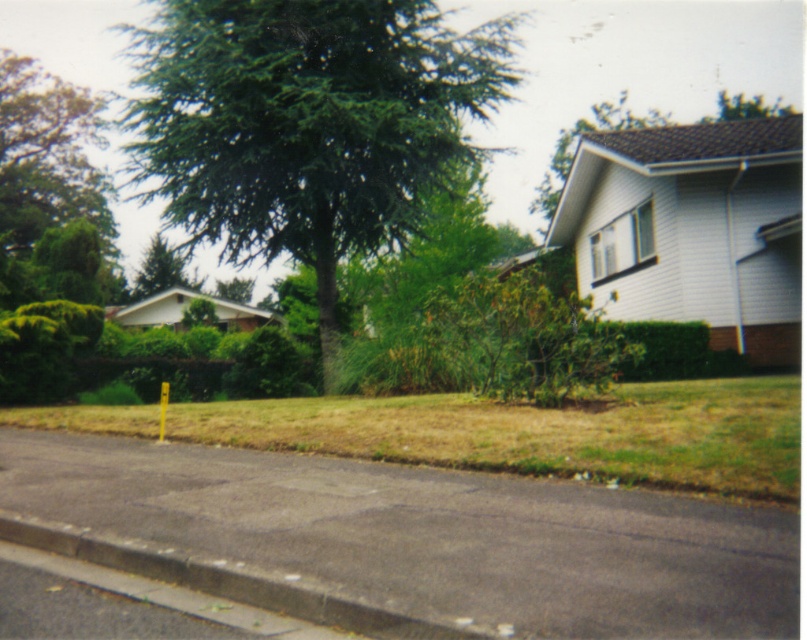
You are a gardener planning to plant a new flower bed between the gray concrete curb at lower left and the green matte tree at upper left. Based on their positions, which object is closer to the front of the scene?

The gray concrete curb at lower left is closer to the front of the scene because it is positioned under the green matte tree at upper left, indicating it is in a lower, more foreground position.

You are a gardener planning to install a new sprinkler system along the gray concrete curb at lower left and the green matte tree at upper left. Based on their widths, which object requires a wider water spray coverage area?

The green matte tree at upper left requires a wider water spray coverage area because it is thicker than the gray concrete curb at lower left.